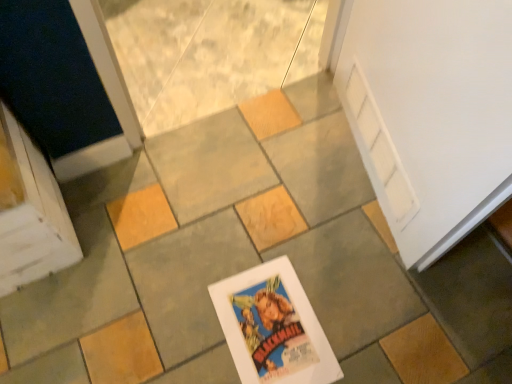
The width and height of the screenshot is (512, 384). What are the coordinates of `free space to the left of white paper picture frame at center` in the screenshot? It's located at (173, 315).